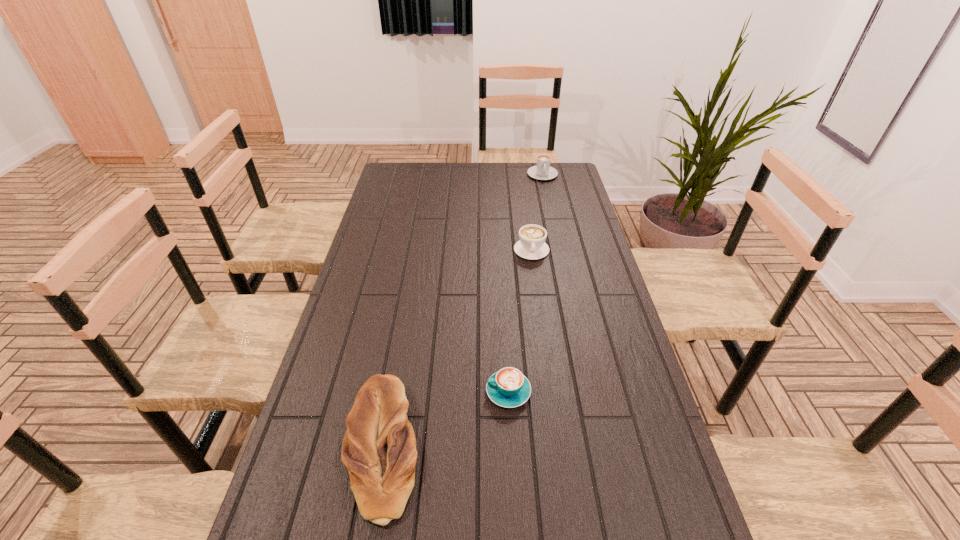
This screenshot has height=540, width=960. Find the location of `the farthest cappuccino`. the farthest cappuccino is located at coordinates (543, 171).

Where is `the second farthest object`? the second farthest object is located at coordinates (532, 245).

The width and height of the screenshot is (960, 540). In order to click on bread in this screenshot , I will do `click(379, 450)`.

Where is `the shortest cappuccino`? the shortest cappuccino is located at coordinates (508, 387).

Image resolution: width=960 pixels, height=540 pixels. What are the coordinates of `the shortest object` in the screenshot? It's located at (508, 387).

This screenshot has height=540, width=960. In order to click on free space located 0.110m to the right of the farthest cappuccino in this screenshot , I will do `click(546, 195)`.

Where is `vacant area situated 0.200m to the right of the second farthest cappuccino's handle`? vacant area situated 0.200m to the right of the second farthest cappuccino's handle is located at coordinates (539, 302).

Image resolution: width=960 pixels, height=540 pixels. I want to click on free location located on the right of the bread, so click(x=506, y=447).

Find the location of a particular element. The image size is (960, 540). free space located with the handle on the right side of the shortest cappuccino is located at coordinates (386, 392).

Image resolution: width=960 pixels, height=540 pixels. I want to click on free space located 0.350m with the handle on the right side of the shortest cappuccino, so click(351, 392).